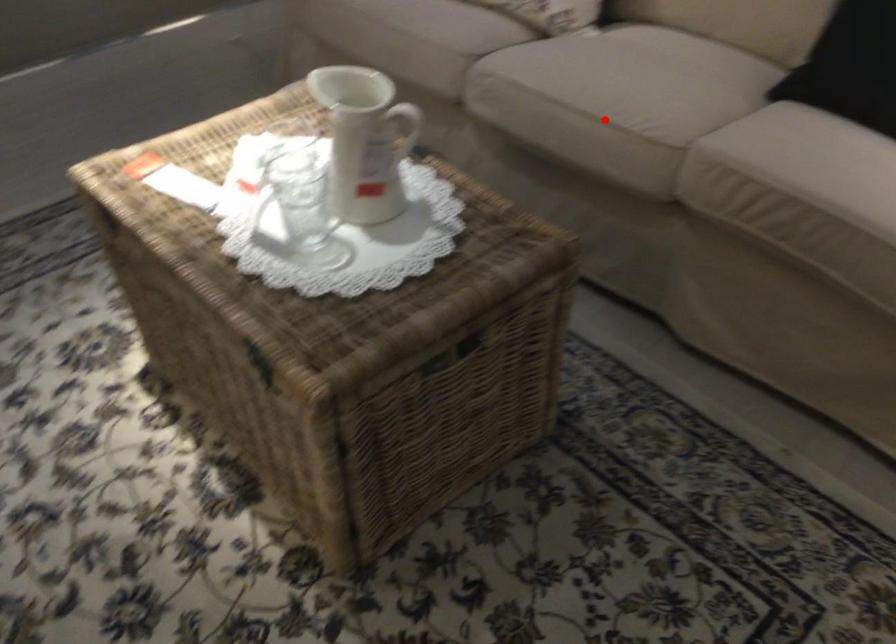
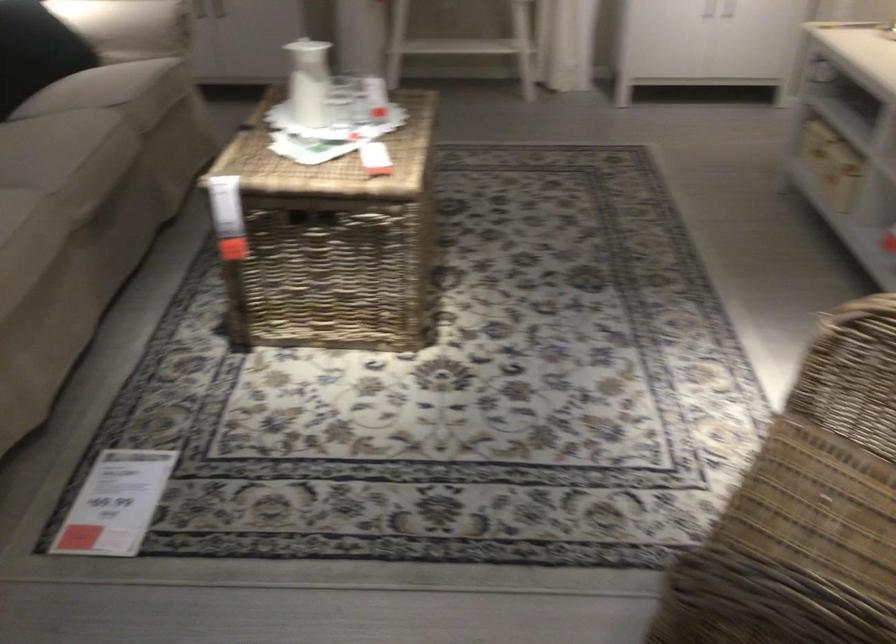
Question: I am providing you with two images of the same scene from different viewpoints. A red point is shown in image1. For the corresponding object point in image2, is it positioned nearer or farther from the camera?

Choices:
 (A) Nearer
 (B) Farther

Answer: (B)